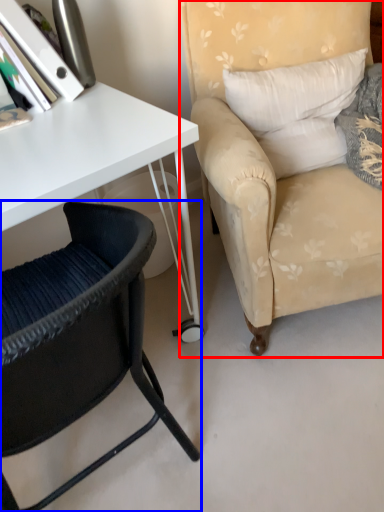
Question: Which object appears closest to the camera in this image, chair (highlighted by a red box) or chair (highlighted by a blue box)?

Choices:
 (A) chair
 (B) chair

Answer: (B)